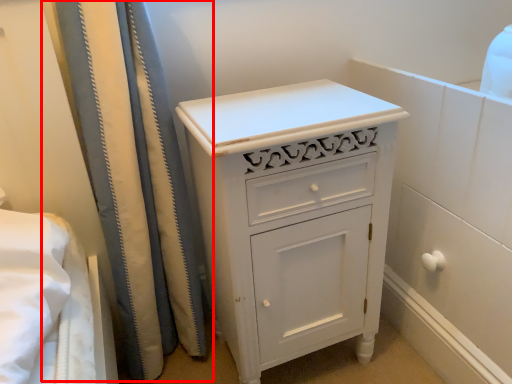
Question: From the image's perspective, where is shower curtain (annotated by the red box) located in relation to chest of drawers in the image?

Choices:
 (A) below
 (B) above

Answer: (B)